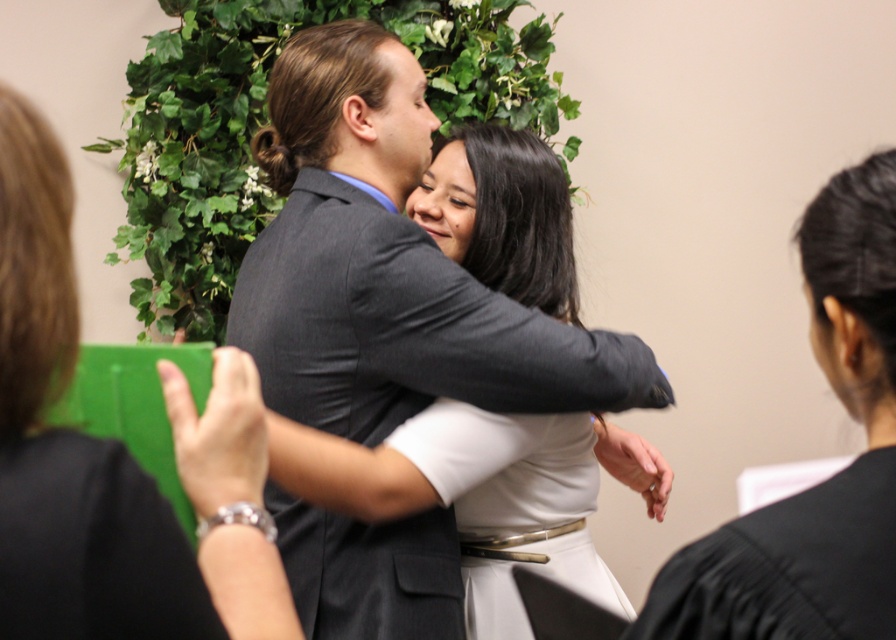
Question: Can you confirm if dark gray suit at center is positioned above matte black dress at center?

Choices:
 (A) no
 (B) yes

Answer: (B)

Question: Which object is positioned farthest from the white satin dress at center?

Choices:
 (A) dark gray suit at center
 (B) matte black dress at center

Answer: (B)

Question: Which object appears closest to the camera in this image?

Choices:
 (A) dark gray suit at center
 (B) matte black dress at center

Answer: (B)

Question: Which of the following is the farthest from the observer?

Choices:
 (A) dark gray suit at center
 (B) matte black dress at center
 (C) white satin dress at center

Answer: (C)

Question: In this image, where is matte black dress at center located relative to white satin dress at center?

Choices:
 (A) right
 (B) left

Answer: (B)

Question: Can you confirm if dark gray suit at center is wider than white satin dress at center?

Choices:
 (A) yes
 (B) no

Answer: (A)